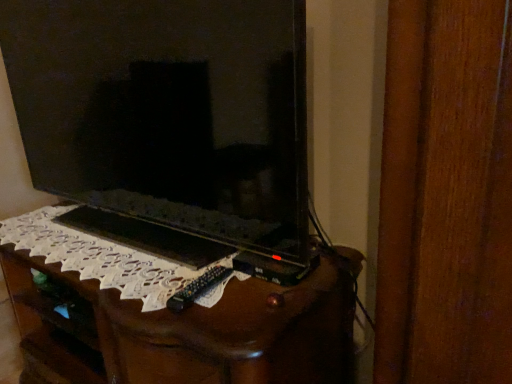
Where is `free point above wooden tv stand at center (from a real-world perspective)`? The image size is (512, 384). free point above wooden tv stand at center (from a real-world perspective) is located at coordinates tap(117, 249).